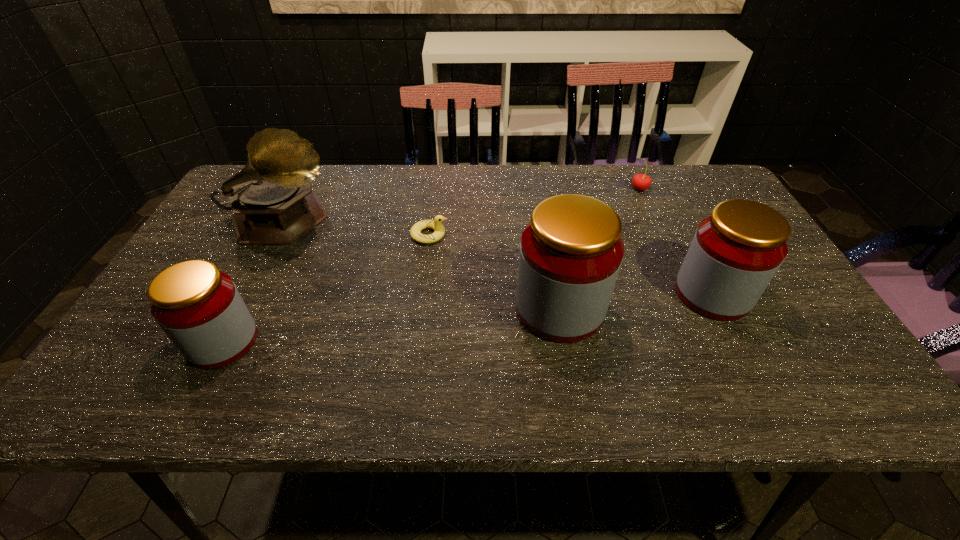
This screenshot has height=540, width=960. Find the location of `spot to insert another jar for uniform distribution`. spot to insert another jar for uniform distribution is located at coordinates (396, 325).